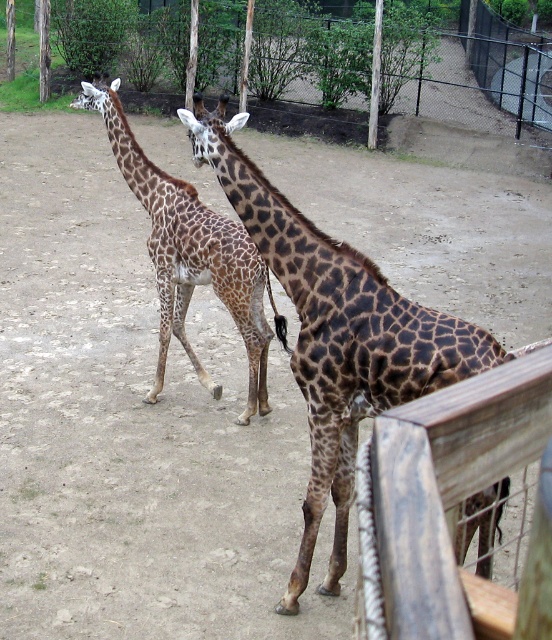
You are a zookeeper trying to determine if a new feeding platform can fit between the wooden fence at right and the spotted fur giraffe at center. The platform requires a minimum width of 1 meter. Based on the image, can you confirm if there is enough space between them?

The wooden fence at right is thinner than the spotted fur giraffe at center, but without specific measurements of the distance between them, it is impossible to confirm if the 1 meter requirement is met. Additional information is needed.

Consider the image. You are a zookeeper trying to determine the layout of the enclosure. You see the wooden fence at upper center and the wooden fence at right. Which fence is positioned to the right side of the other?

The wooden fence at upper center is to the right of the wooden fence at right.

You are a zookeeper trying to determine the best path to approach the brown spotted giraffe at center without getting too close to the wooden fence at upper center. Based on their positions, which direction should you move relative to the giraffe?

Since the wooden fence at upper center is to the right of the brown spotted giraffe at center, you should approach from the left side of the giraffe to avoid the fence.